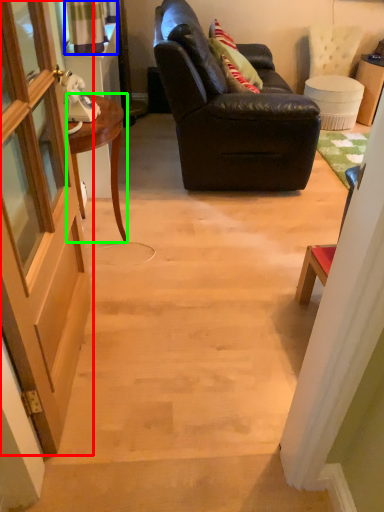
Question: Which object is positioned closest to door (highlighted by a red box)? Select from curtain (highlighted by a blue box) and desk (highlighted by a green box).

Choices:
 (A) curtain
 (B) desk

Answer: (B)